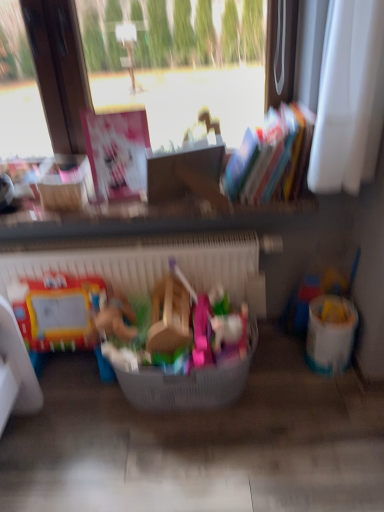
This screenshot has height=512, width=384. I want to click on white plastic bucket at right, so click(330, 334).

Image resolution: width=384 pixels, height=512 pixels. Describe the element at coordinates (151, 263) in the screenshot. I see `white plastic radiator at center` at that location.

Describe the element at coordinates (314, 295) in the screenshot. This screenshot has height=512, width=384. I see `translucent plastic bucket at right, acting as the 2th toy starting from the left` at that location.

What do you see at coordinates (171, 329) in the screenshot? I see `plastic basket at center, positioned as the second toy in right-to-left order` at bounding box center [171, 329].

Locate an element on the screen. The width and height of the screenshot is (384, 512). plastic basket at center is located at coordinates (189, 383).

Is point (287, 333) less distant than point (256, 330)?

That is False.

Is the depth of translucent plastic bucket at right, the first toy viewed from the back, greater than that of plastic basket at center?

Yes, it is.

How different are the orientations of translucent plastic bucket at right, which is the 1th toy from right to left, and plastic basket at center in degrees?

translucent plastic bucket at right, which is the 1th toy from right to left, and plastic basket at center are facing 30.8 degrees away from each other.

Is white plastic bucket at right at the back of plastic basket at center?

No, white plastic bucket at right is not at the back of plastic basket at center.

Which object is closer to the camera taking this photo, plastic basket at center or white plastic bucket at right?

plastic basket at center.

In terms of height, does plastic basket at center look taller or shorter compared to white plastic bucket at right?

plastic basket at center is shorter than white plastic bucket at right.

Is plastic basket at center located outside white plastic bucket at right?

Absolutely, plastic basket at center is external to white plastic bucket at right.

I want to click on toy located on the right of plastic basket at center, which is counted as the first toy, starting from the front, so click(x=314, y=295).

From their relative heights in the image, would you say translucent plastic bucket at right, the first toy viewed from the back, is taller or shorter than plastic basket at center, positioned as the second toy in right-to-left order?

Considering their sizes, translucent plastic bucket at right, the first toy viewed from the back, has more height than plastic basket at center, positioned as the second toy in right-to-left order.

From a real-world perspective, who is located lower, translucent plastic bucket at right, the first toy viewed from the back, or plastic basket at center, the first toy in the left-to-right sequence?

translucent plastic bucket at right, the first toy viewed from the back, from a real-world perspective.

Can you tell me how much translucent plastic bucket at right, the first toy viewed from the back, and plastic basket at center, which is counted as the first toy, starting from the front, differ in facing direction?

There is a 30.8-degree angle between the facing directions of translucent plastic bucket at right, the first toy viewed from the back, and plastic basket at center, which is counted as the first toy, starting from the front.

Are translucent plastic bucket at right, acting as the 2th toy starting from the left, and white plastic radiator at center making contact?

translucent plastic bucket at right, acting as the 2th toy starting from the left, and white plastic radiator at center are not in contact.

In the image, is translucent plastic bucket at right, the second toy when ordered from front to back, on the left side or the right side of white plastic radiator at center?

From the image, it's evident that translucent plastic bucket at right, the second toy when ordered from front to back, is to the right of white plastic radiator at center.

Would you say translucent plastic bucket at right, which is the 1th toy from right to left, is outside white plastic radiator at center?

Yes, translucent plastic bucket at right, which is the 1th toy from right to left, is outside of white plastic radiator at center.

Does translucent plastic bucket at right, which is the 1th toy from right to left, lie in front of white plastic radiator at center?

That is False.

Consider the image. Is white plastic radiator at center far from plastic basket at center?

No, white plastic radiator at center is in close proximity to plastic basket at center.

In terms of height, does white plastic radiator at center look taller or shorter compared to plastic basket at center?

Clearly, white plastic radiator at center is taller compared to plastic basket at center.

Considering the relative sizes of white plastic radiator at center and plastic basket at center in the image provided, is white plastic radiator at center smaller than plastic basket at center?

Incorrect, white plastic radiator at center is not smaller in size than plastic basket at center.

In terms of height, does multicolored paper book at upper right look taller or shorter compared to plastic basket at center?

Clearly, multicolored paper book at upper right is taller compared to plastic basket at center.

Considering the positions of point (232, 153) and point (221, 369), is point (232, 153) closer or farther from the camera than point (221, 369)?

Point (232, 153) is positioned farther from the camera compared to point (221, 369).

Is multicolored paper book at upper right turned away from plastic basket at center?

No, plastic basket at center is not at the back of multicolored paper book at upper right.

Is multicolored paper book at upper right aimed at plastic basket at center, which is counted as the first toy, starting from the front?

No, multicolored paper book at upper right is not aimed at plastic basket at center, which is counted as the first toy, starting from the front.

Between multicolored paper book at upper right and plastic basket at center, positioned as the second toy in right-to-left order, which one has smaller width?

multicolored paper book at upper right.

You are a GUI agent. You are given a task and a screenshot of the screen. Output one action in this format:
    pyautogui.click(x=<x>, y=<y>)
    Task: Click on the 2nd toy positioned below the multicolored paper book at upper right (from the image's perspective)
    The width and height of the screenshot is (384, 512).
    Given the screenshot: What is the action you would take?
    pyautogui.click(x=171, y=329)

From the image's perspective, which one is positioned lower, multicolored paper book at upper right or plastic basket at center, positioned as the second toy in right-to-left order?

plastic basket at center, positioned as the second toy in right-to-left order, from the image's perspective.

I want to click on basket in front of the translucent plastic bucket at right, which is the 1th toy from right to left, so click(x=189, y=383).

Locate an element on the screen. This screenshot has width=384, height=512. recycling bin below the plastic basket at center (from a real-world perspective) is located at coordinates tap(330, 334).

Based on the photo, looking at the image, which one is located further to white plastic bucket at right, multicolored paper book at upper right or plastic basket at center, which is counted as the first toy, starting from the front?

Among the two, multicolored paper book at upper right is located further to white plastic bucket at right.

From the image, which object appears to be nearer to multicolored paper book at upper right, white plastic bucket at right or translucent plastic bucket at right, the second toy when ordered from front to back?

translucent plastic bucket at right, the second toy when ordered from front to back, lies closer to multicolored paper book at upper right than the other object.

Considering their positions, is white plastic radiator at center positioned further to translucent plastic bucket at right, the second toy when ordered from front to back, than multicolored paper book at upper right?

multicolored paper book at upper right is positioned further to the anchor translucent plastic bucket at right, the second toy when ordered from front to back.

Looking at the image, which one is located further to white plastic radiator at center, plastic basket at center, the first toy in the left-to-right sequence, or white plastic bucket at right?

The object further to white plastic radiator at center is white plastic bucket at right.

Based on their spatial positions, is multicolored paper book at upper right or white plastic radiator at center further from translucent plastic bucket at right, the first toy viewed from the back?

multicolored paper book at upper right lies further to translucent plastic bucket at right, the first toy viewed from the back, than the other object.

From the image, which object appears to be farther from white plastic bucket at right, translucent plastic bucket at right, acting as the 2th toy starting from the left, or plastic basket at center?

The object further to white plastic bucket at right is plastic basket at center.

From the image, which object appears to be nearer to white plastic bucket at right, white plastic radiator at center or multicolored paper book at upper right?

white plastic radiator at center.

Consider the image. From the image, which object appears to be nearer to plastic basket at center, translucent plastic bucket at right, acting as the 2th toy starting from the left, or white plastic bucket at right?

The object closer to plastic basket at center is white plastic bucket at right.

Identify the location of book between white plastic radiator at center and white plastic bucket at right from left to right. (265, 155).

What are the coordinates of `radiator that lies between multicolored paper book at upper right and plastic basket at center, the 2th toy viewed from the back, from top to bottom` in the screenshot? It's located at (151, 263).

Identify the location of toy between multicolored paper book at upper right and plastic basket at center, the first toy in the left-to-right sequence, in the up-down direction. The height and width of the screenshot is (512, 384). (314, 295).

The height and width of the screenshot is (512, 384). I want to click on basket situated between plastic basket at center, which is counted as the first toy, starting from the front, and translucent plastic bucket at right, which is the 1th toy from right to left, from left to right, so click(189, 383).